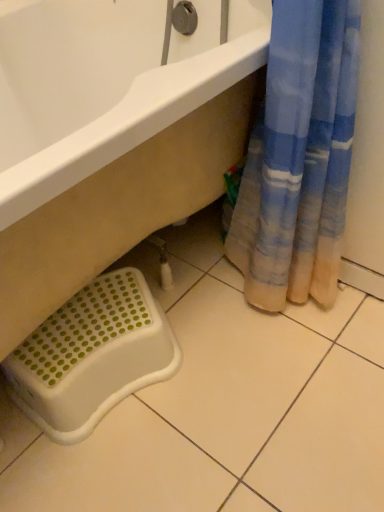
Question: Is white plastic bathtub at lower left in front of or behind white plastic step stool at lower left in the image?

Choices:
 (A) behind
 (B) front

Answer: (B)

Question: Is white plastic bathtub at lower left taller or shorter than white plastic step stool at lower left?

Choices:
 (A) short
 (B) tall

Answer: (B)

Question: From a real-world perspective, is white plastic bathtub at lower left physically located above or below white plastic step stool at lower left?

Choices:
 (A) below
 (B) above

Answer: (B)

Question: From a real-world perspective, is white plastic step stool at lower left above or below white plastic bathtub at lower left?

Choices:
 (A) above
 (B) below

Answer: (B)

Question: Visually, is white plastic step stool at lower left positioned to the left or to the right of white plastic bathtub at lower left?

Choices:
 (A) left
 (B) right

Answer: (B)

Question: Is white plastic step stool at lower left wider or thinner than white plastic bathtub at lower left?

Choices:
 (A) wide
 (B) thin

Answer: (B)

Question: From the image's perspective, is white plastic step stool at lower left positioned above or below white plastic bathtub at lower left?

Choices:
 (A) above
 (B) below

Answer: (B)